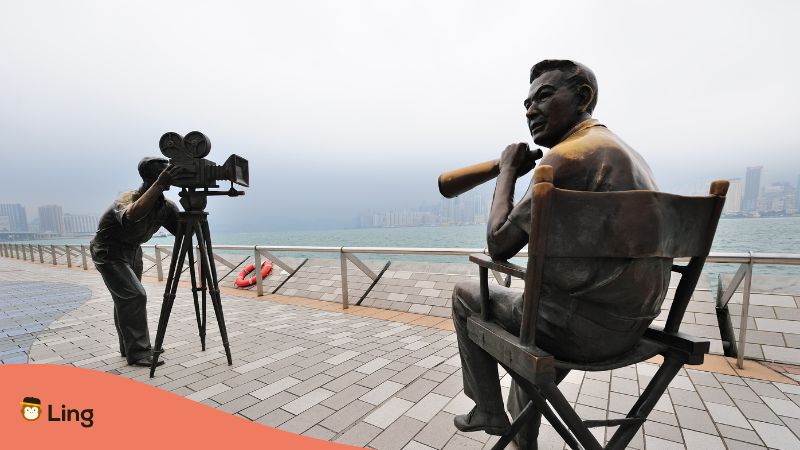
The width and height of the screenshot is (800, 450). I want to click on 1 camera, so click(173, 163).